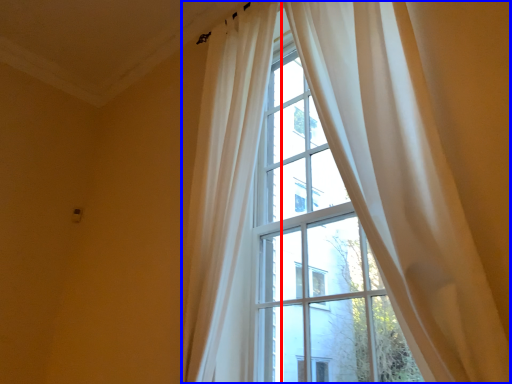
Question: Among these objects, which one is nearest to the camera, curtain (highlighted by a red box) or curtain (highlighted by a blue box)?

Choices:
 (A) curtain
 (B) curtain

Answer: (B)